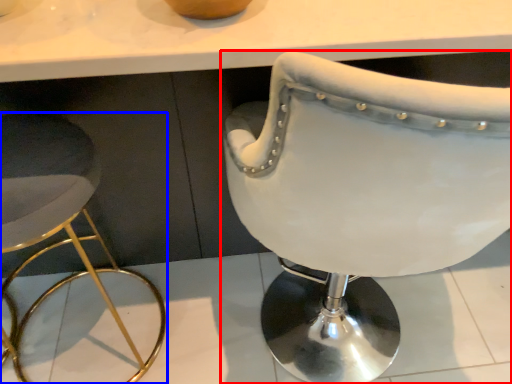
Question: Which of the following is the farthest to the observer, chair (highlighted by a red box) or stool (highlighted by a blue box)?

Choices:
 (A) chair
 (B) stool

Answer: (B)